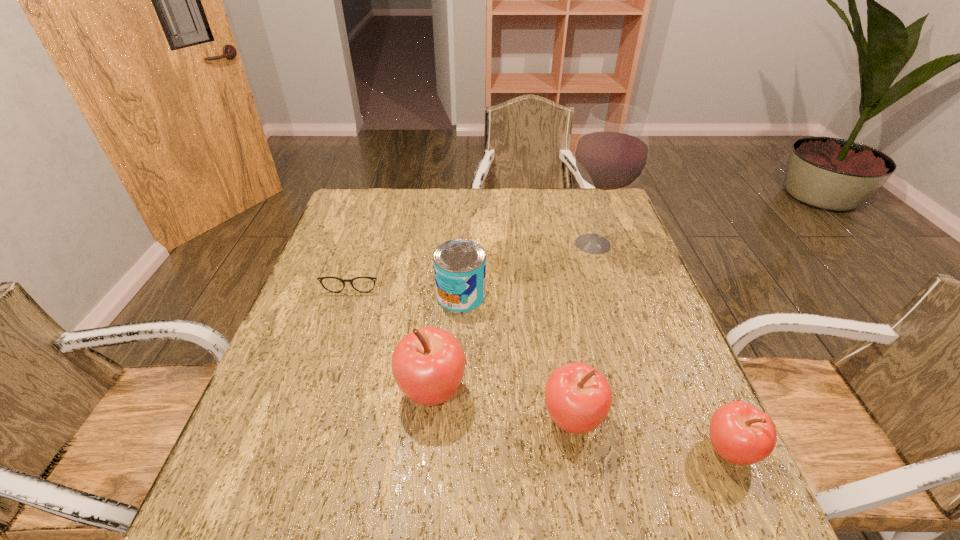
All apples are currently evenly spaced. To continue this pattern, where would you add another apple on the left? Please point out a vacant spot. Please provide its 2D coordinates. Your answer should be formatted as a tuple, i.e. [(x, y)], where the tuple contains the x and y coordinates of a point satisfying the conditions above.

[(306, 366)]